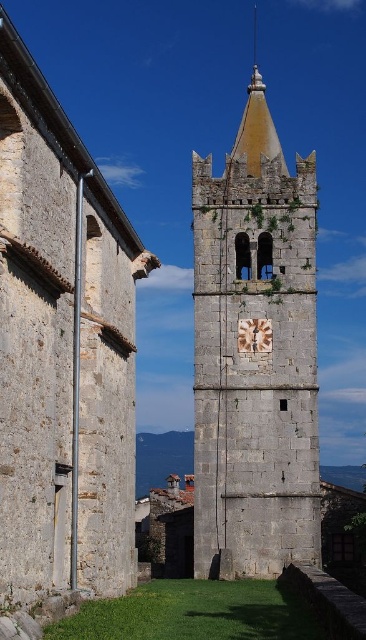
You are a tourist visiting the historic site and want to take a photo of both the gray stone church tower at center and the gray stone bell tower at center. Which one should you focus on to ensure both are fully visible in your photo?

You should focus on the gray stone bell tower at center because it is taller than the gray stone church tower at center, so capturing it in the frame will naturally include the shorter one as well.

You are an architect analyzing the image of a historic building. You notice two structures labeled as the gray stone church tower at center and the gray stone bell tower at center. Which of these two occupies a smaller area in the image?

The gray stone church tower at center occupies less space than the gray stone bell tower at center, so it is the smaller one in terms of area.

You are standing in front of the historic stone church tower. There is a gray stone bell tower at center. Where is the point located at coordinate (255, 355)?

The point at coordinate (255, 355) corresponds to the gray stone bell tower at center.